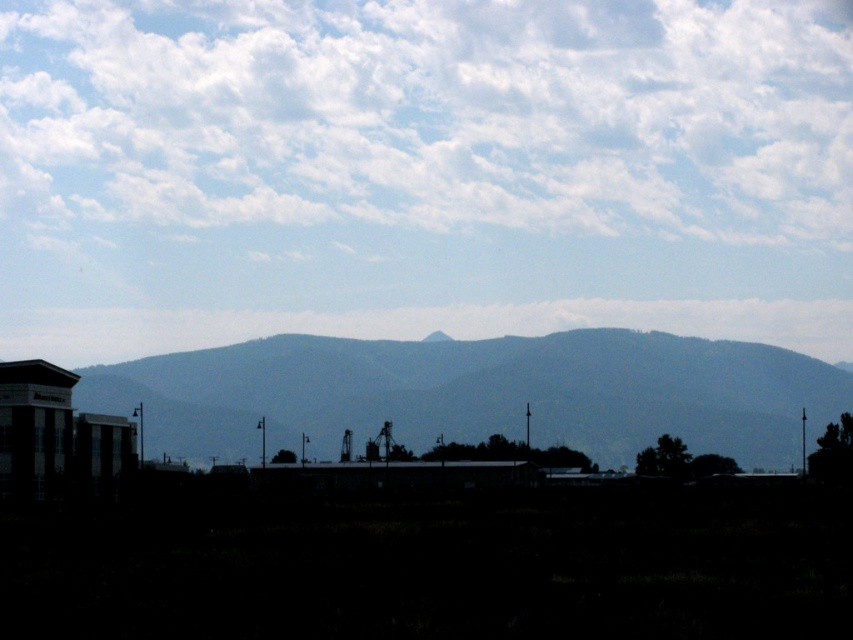
You are an airplane pilot preparing to fly over the white fluffy cloud at upper center and the gray textured mountain range at center. Which object would you need to navigate around first based on their positions in the image?

The white fluffy cloud at upper center is positioned higher in the sky compared to the gray textured mountain range at center, so you would encounter the white fluffy cloud at upper center first during your flight.

Based on the photo, you are standing in the foreground of the landscape image. You see two points marked in the scene. The first point is at coordinate point (457,38) and the second is at point (281,420). Which point is closer to your current position?

Point (281,420) is closer to your current position because it is less further to the camera than point (457,38).